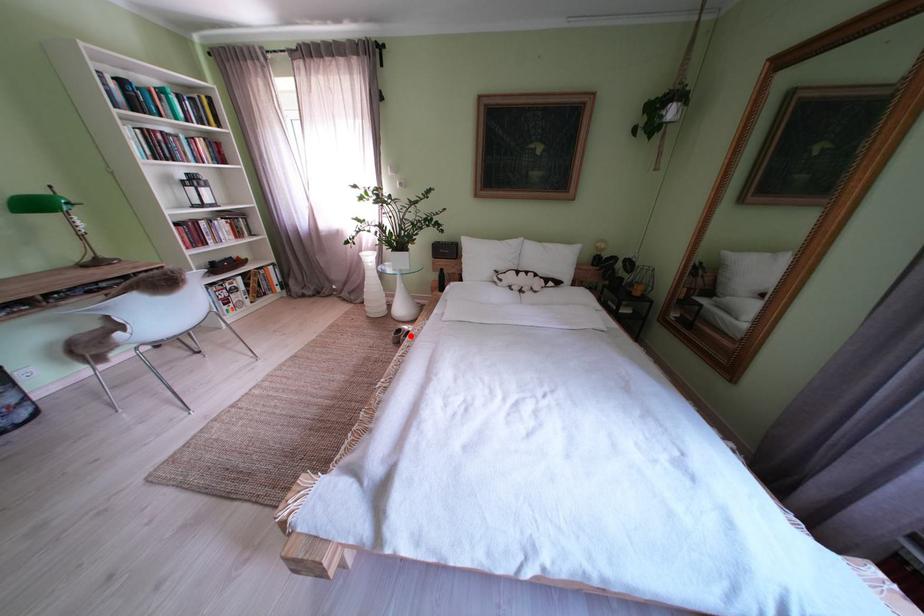
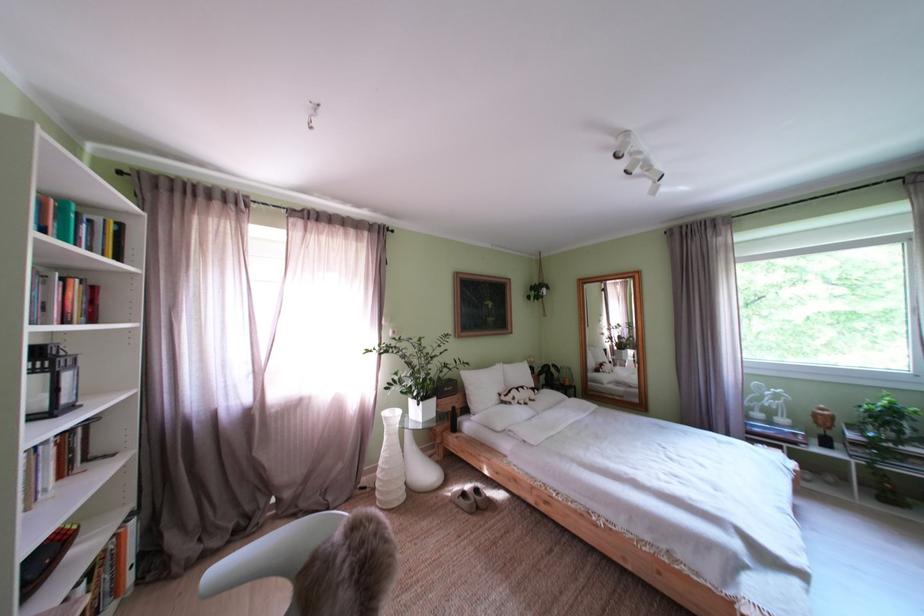
Question: A red point is marked in image1. In image2, is the corresponding 3D point closer to the camera or farther? Reply with the corresponding letter.

Choices:
 (A) The corresponding 3D point is closer.
 (B) The corresponding 3D point is farther.

Answer: (A)